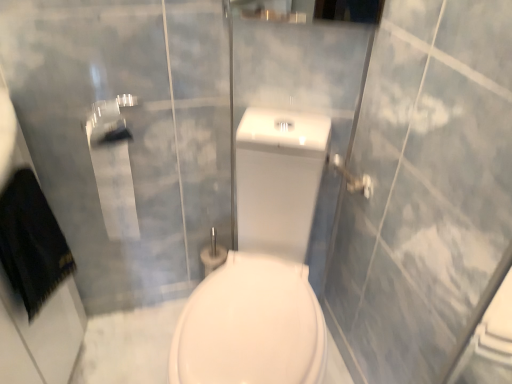
Question: Is metallic silver towel bar at upper right bigger or smaller than white glossy porcelain at center?

Choices:
 (A) small
 (B) big

Answer: (A)

Question: Is metallic silver towel bar at upper right in front of or behind white glossy porcelain at center in the image?

Choices:
 (A) behind
 (B) front

Answer: (A)

Question: Which is correct: metallic silver towel bar at upper right is inside white glossy porcelain at center, or outside of it?

Choices:
 (A) outside
 (B) inside

Answer: (B)

Question: Relative to metallic silver towel bar at upper right, is white glossy porcelain at center in front or behind?

Choices:
 (A) front
 (B) behind

Answer: (A)

Question: In terms of height, does white glossy porcelain at center look taller or shorter compared to metallic silver towel bar at upper right?

Choices:
 (A) tall
 (B) short

Answer: (A)

Question: From the image's perspective, relative to metallic silver towel bar at upper right, is white glossy porcelain at center above or below?

Choices:
 (A) above
 (B) below

Answer: (B)

Question: Is point click(x=221, y=352) positioned closer to the camera than point click(x=345, y=175)?

Choices:
 (A) farther
 (B) closer

Answer: (B)